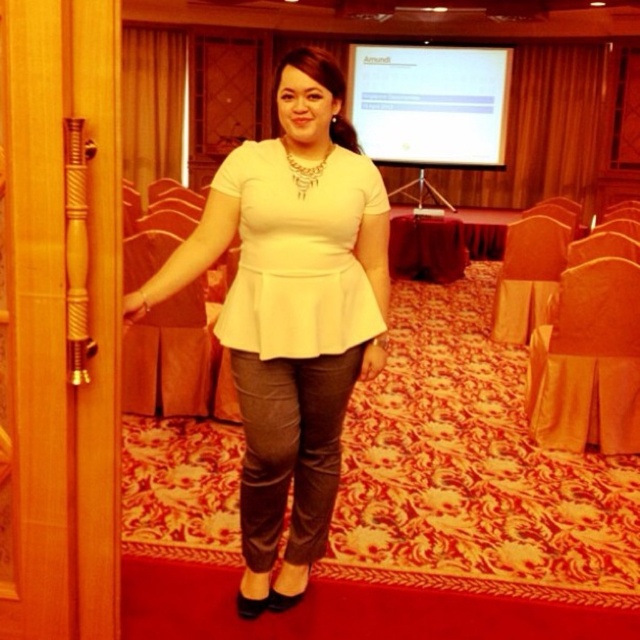
You are organizing a fashion show and need to arrange outfits from left to right based on their position in the image. Which should come first, the matte white blouse at center or the white matte peplum top at center?

The matte white blouse at center should come first in the arrangement since it is positioned on the left side of the white matte peplum top at center in the image.